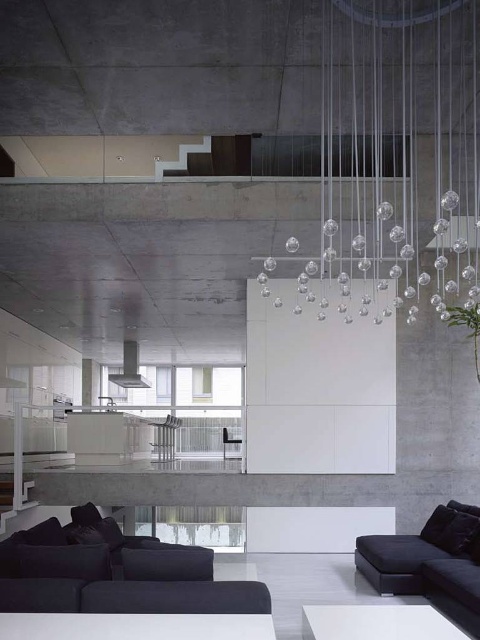
You are standing in the room and want to sit on the dark gray fabric couch at lower left. Which direction should you move to face the transparent glass chandelier at upper center?

You should move to your right because the transparent glass chandelier at upper center is located to the right of the dark gray fabric couch at lower left.

You are a delivery person trying to place a large package that is 1.2 meters long between the dark gray fabric couch at lower left and the white glossy coffee table at lower center. Based on the space between them, will the package fit without being moved?

The distance between the dark gray fabric couch at lower left and the white glossy coffee table at lower center is 1.08 meters, which is shorter than the package length of 1.2 meters. Therefore, the package will not fit between them without moving at least one of the objects.

You are a guest entering the room and want to sit on the black leather couch at lower right. Which direction should you look to see the transparent glass chandelier at upper center?

The transparent glass chandelier at upper center is located above the black leather couch at lower right, so you should look upward to see it.